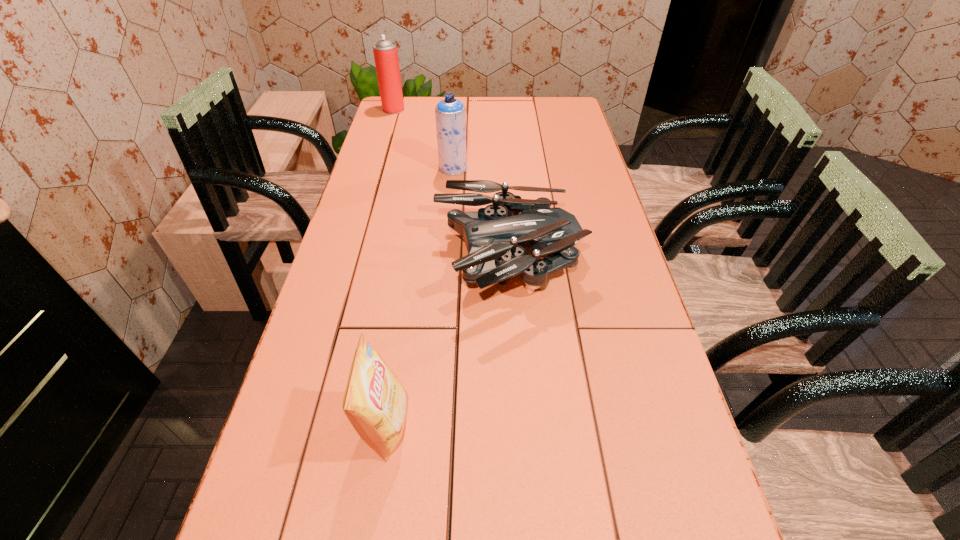
Find the location of a particular element. The image size is (960, 540). vacant space situated 0.300m on the front-facing side of the nearest object is located at coordinates (561, 424).

The height and width of the screenshot is (540, 960). I want to click on vacant space located on the left of the shortest object, so click(389, 263).

Where is `object located at the far edge`? The width and height of the screenshot is (960, 540). object located at the far edge is located at coordinates (385, 52).

Image resolution: width=960 pixels, height=540 pixels. I want to click on object located in the left edge section of the desktop, so [x=385, y=52].

This screenshot has height=540, width=960. I want to click on object that is at the right edge, so click(x=495, y=236).

The image size is (960, 540). Find the location of `object that is at the far left corner`. object that is at the far left corner is located at coordinates (385, 52).

Where is `vacant space at the far edge of the desktop`? The width and height of the screenshot is (960, 540). vacant space at the far edge of the desktop is located at coordinates (503, 98).

This screenshot has width=960, height=540. In the image, there is a desktop. What are the coordinates of `vacant region at the left edge` in the screenshot? It's located at (x=328, y=274).

Find the location of a particular element. vacant space at the right edge of the desktop is located at coordinates (596, 170).

Find the location of a particular element. vacant space at the far right corner is located at coordinates (559, 111).